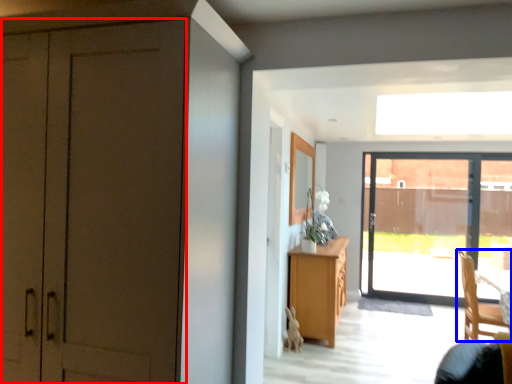
Question: Which of the following is the closest to the observer, door (highlighted by a red box) or chair (highlighted by a blue box)?

Choices:
 (A) door
 (B) chair

Answer: (A)